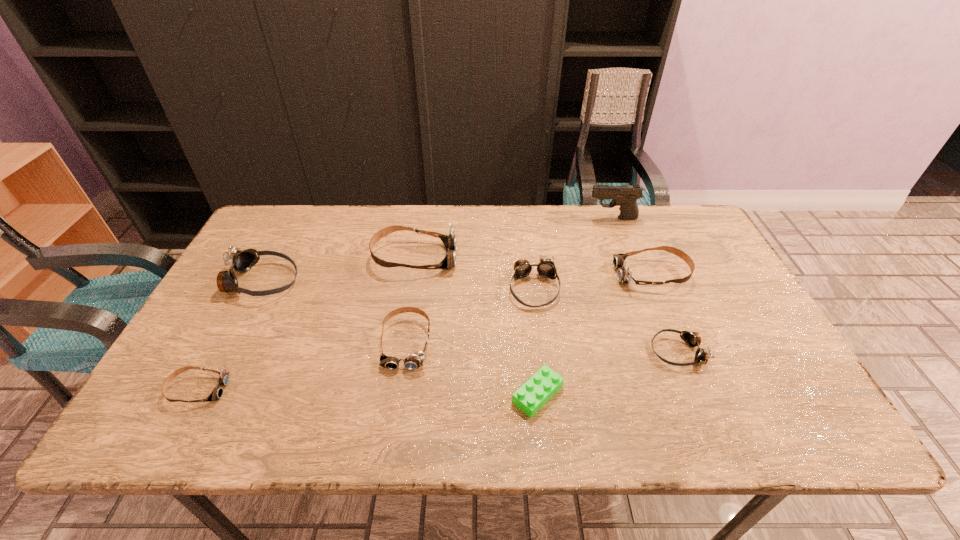
Locate an element on the screen. This screenshot has width=960, height=540. goggles that is the second closest to the green Lego is located at coordinates (546, 268).

Choose which goggles is the nearest neighbor to the rightmost bronze goggles. Please provide its 2D coordinates. Your answer should be formatted as a tuple, i.e. [(x, y)], where the tuple contains the x and y coordinates of a point satisfying the conditions above.

[(624, 275)]

Point out which brown goggles is positioned as the nearest to the second nearest brown goggles. Please provide its 2D coordinates. Your answer should be formatted as a tuple, i.e. [(x, y)], where the tuple contains the x and y coordinates of a point satisfying the conditions above.

[(449, 240)]

The image size is (960, 540). Identify the location of brown goggles that is the third nearest to the leftmost brown goggles. (624, 275).

At what (x,y) coordinates should I click in order to perform the action: click on bronze goggles that can be found as the second closest to the smallest bronze goggles. Please return your answer as a coordinate pair (x, y). This screenshot has width=960, height=540. Looking at the image, I should click on (240, 261).

Identify which bronze goggles is the third nearest to the tallest object. Please provide its 2D coordinates. Your answer should be formatted as a tuple, i.e. [(x, y)], where the tuple contains the x and y coordinates of a point satisfying the conditions above.

[(240, 261)]

You are a GUI agent. You are given a task and a screenshot of the screen. Output one action in this format:
    pyautogui.click(x=<x>, y=<y>)
    Task: Click on the vacant space that satisfies the following two spatial constraints: 1. on the front-facing side of the rightmost brown goggles; 2. on the front-facing side of the third farthest brown goggles
    This screenshot has width=960, height=540.
    Given the screenshot: What is the action you would take?
    pyautogui.click(x=680, y=342)

I want to click on free point that satisfies the following two spatial constraints: 1. on the front-facing side of the Lego; 2. on the left side of the nearest brown goggles, so click(196, 394).

Locate an element on the screen. This screenshot has width=960, height=540. free location that satisfies the following two spatial constraints: 1. at the barrel of the pistol; 2. through the lenses of the second biggest bronze goggles is located at coordinates (639, 288).